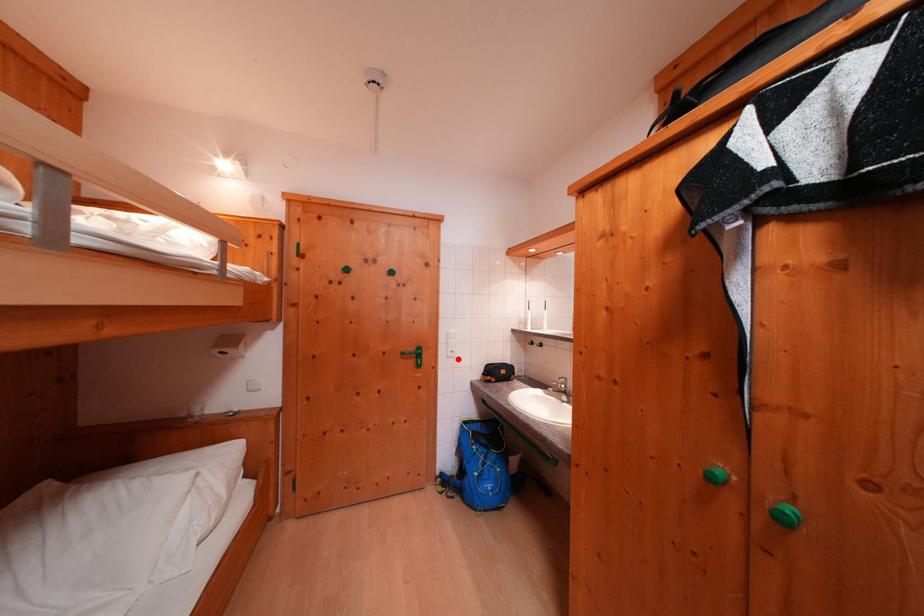
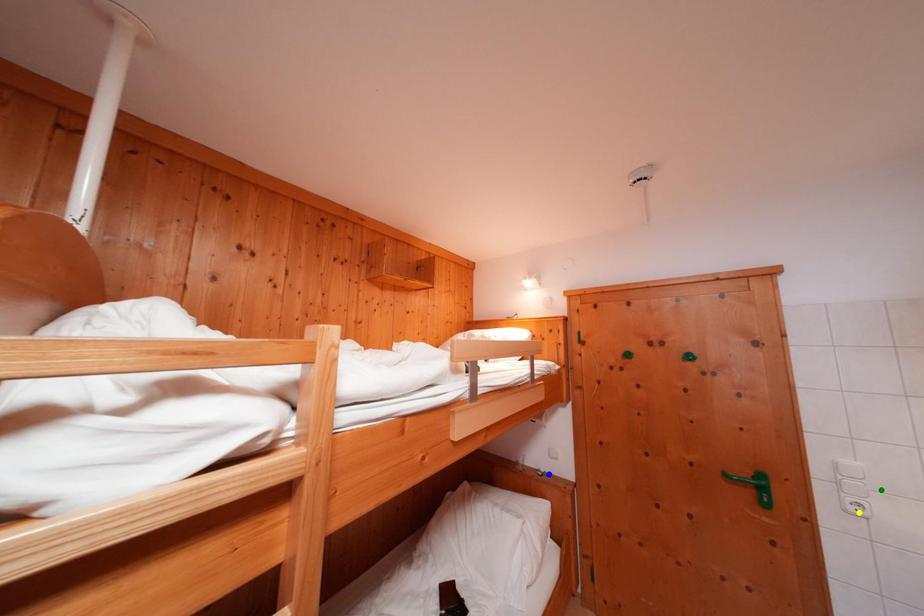
Question: I am providing you with two images of the same scene from different viewpoints. A red point is marked on the first image. You are given multiple points on the second image. In image 2, which mark is for the same physical point as the one in image 1?

Choices:
 (A) blue point
 (B) green point
 (C) yellow point

Answer: (C)